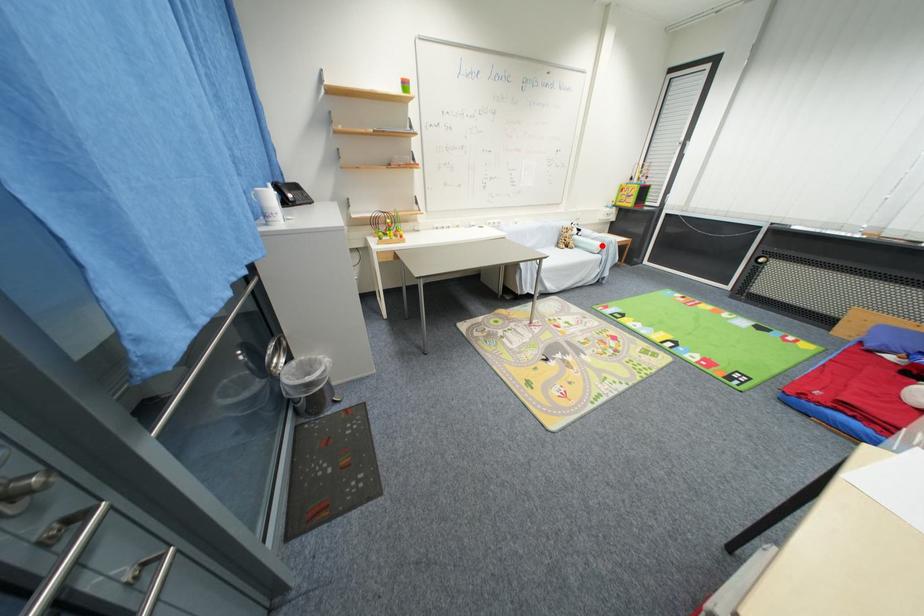
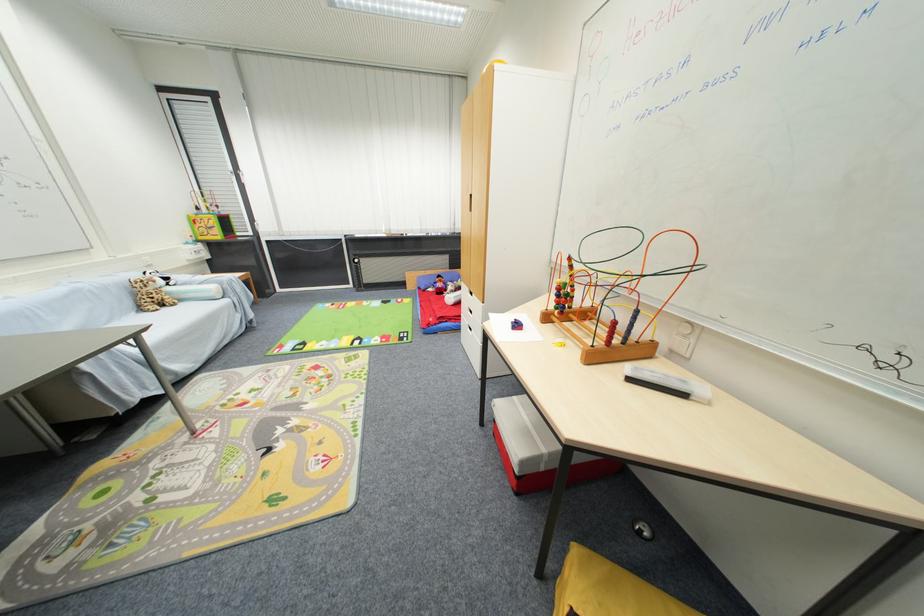
Where in the second image is the point corresponding to the highlighted location from the first image?

(217, 290)